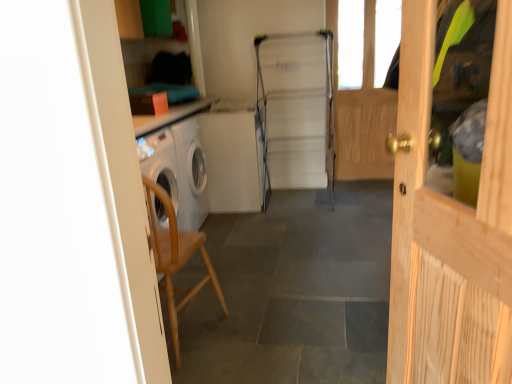
Question: Would you say metallic silver fridge at center contains light wood door at right?

Choices:
 (A) yes
 (B) no

Answer: (B)

Question: Would you say metallic silver fridge at center is outside light wood door at right?

Choices:
 (A) no
 (B) yes

Answer: (B)

Question: Is metallic silver fridge at center smaller than light wood door at right?

Choices:
 (A) no
 (B) yes

Answer: (A)

Question: Are metallic silver fridge at center and light wood door at right located far from each other?

Choices:
 (A) yes
 (B) no

Answer: (A)

Question: Is metallic silver fridge at center at the left side of light wood door at right?

Choices:
 (A) no
 (B) yes

Answer: (B)

Question: From a real-world perspective, is metallic silver fridge at center beneath light wood door at right?

Choices:
 (A) no
 (B) yes

Answer: (B)

Question: Considering the relative sizes of metallic silver fridge at center and wooden screen door at right in the image provided, is metallic silver fridge at center shorter than wooden screen door at right?

Choices:
 (A) no
 (B) yes

Answer: (B)

Question: Is metallic silver fridge at center looking in the opposite direction of wooden screen door at right?

Choices:
 (A) yes
 (B) no

Answer: (B)

Question: From the image's perspective, is metallic silver fridge at center located above wooden screen door at right?

Choices:
 (A) yes
 (B) no

Answer: (B)

Question: Is metallic silver fridge at center at the left side of wooden screen door at right?

Choices:
 (A) no
 (B) yes

Answer: (B)

Question: Does metallic silver fridge at center contain wooden screen door at right?

Choices:
 (A) no
 (B) yes

Answer: (A)

Question: Is metallic silver fridge at center wider than wooden screen door at right?

Choices:
 (A) no
 (B) yes

Answer: (B)

Question: Considering the relative sizes of light wood door at right and wooden chair at left in the image provided, is light wood door at right taller than wooden chair at left?

Choices:
 (A) yes
 (B) no

Answer: (A)